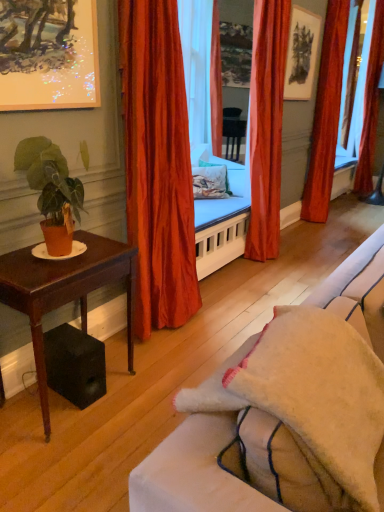
Question: Is transparent glass window screen at right in front of velvet orange curtain at center, the second curtain when ordered from left to right?

Choices:
 (A) no
 (B) yes

Answer: (A)

Question: Considering the relative sizes of transparent glass window screen at right and velvet orange curtain at center, placed as the second curtain when sorted from front to back, in the image provided, is transparent glass window screen at right shorter than velvet orange curtain at center, placed as the second curtain when sorted from front to back,?

Choices:
 (A) no
 (B) yes

Answer: (A)

Question: Is transparent glass window screen at right smaller than velvet orange curtain at center, the second curtain when ordered from left to right?

Choices:
 (A) yes
 (B) no

Answer: (B)

Question: From a real-world perspective, is transparent glass window screen at right over velvet orange curtain at center, the third curtain from the right?

Choices:
 (A) yes
 (B) no

Answer: (A)

Question: Does transparent glass window screen at right have a greater height compared to velvet orange curtain at center, which ranks as the 3th curtain in back-to-front order?

Choices:
 (A) yes
 (B) no

Answer: (A)

Question: Is transparent glass window screen at right looking in the opposite direction of velvet orange curtain at center, the second curtain when ordered from left to right?

Choices:
 (A) no
 (B) yes

Answer: (A)

Question: Is matte black picture frame at upper center, positioned as the first picture frame in right-to-left order, inside floral fabric pillow at center?

Choices:
 (A) yes
 (B) no

Answer: (B)

Question: Can you confirm if floral fabric pillow at center is positioned to the right of matte black picture frame at upper center, which is counted as the first picture frame, starting from the back?

Choices:
 (A) no
 (B) yes

Answer: (A)

Question: From the image's perspective, is floral fabric pillow at center over matte black picture frame at upper center, positioned as the first picture frame in right-to-left order?

Choices:
 (A) yes
 (B) no

Answer: (B)

Question: Can you confirm if floral fabric pillow at center is smaller than matte black picture frame at upper center, positioned as the first picture frame in right-to-left order?

Choices:
 (A) yes
 (B) no

Answer: (B)

Question: Is floral fabric pillow at center behind matte black picture frame at upper center, which is the 2th picture frame from bottom to top?

Choices:
 (A) yes
 (B) no

Answer: (A)

Question: Is the position of floral fabric pillow at center less distant than that of matte black picture frame at upper center, the second picture frame positioned from the front?

Choices:
 (A) yes
 (B) no

Answer: (B)

Question: Can you confirm if transparent glass window screen at right is positioned to the right of floral fabric pillow at center?

Choices:
 (A) no
 (B) yes

Answer: (B)